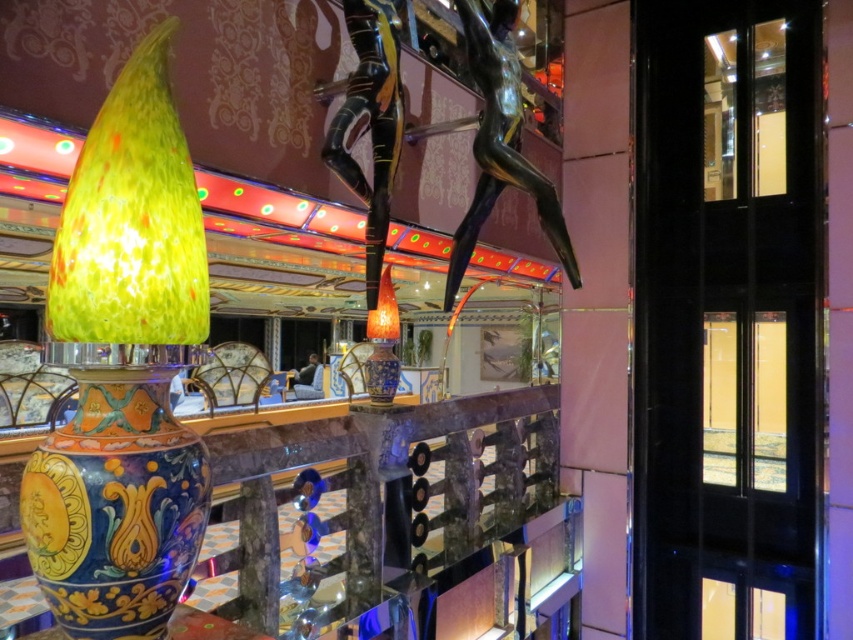
Question: Which of these objects is positioned closest to the hand-painted ceramic vase at center?

Choices:
 (A) glossy black statue at upper center
 (B) black glossy statue at center
 (C) multicolored ceramic vase at left

Answer: (C)

Question: Among these objects, which one is farthest from the camera?

Choices:
 (A) glossy black statue at upper center
 (B) hand-painted ceramic vase at center
 (C) shiny blue glass vase at center

Answer: (A)

Question: Considering the relative positions of glossy black statue at upper center and shiny blue glass vase at center in the image provided, where is glossy black statue at upper center located with respect to shiny blue glass vase at center?

Choices:
 (A) above
 (B) below

Answer: (A)

Question: Can you confirm if hand-painted ceramic vase at center is positioned to the left of black glossy statue at center?

Choices:
 (A) yes
 (B) no

Answer: (A)

Question: Where is multicolored ceramic vase at left located in relation to black glossy statue at center in the image?

Choices:
 (A) right
 (B) left

Answer: (B)

Question: Which of the following is the farthest from the observer?

Choices:
 (A) (349, 182)
 (B) (138, 440)
 (C) (189, 518)
 (D) (515, 144)

Answer: (D)